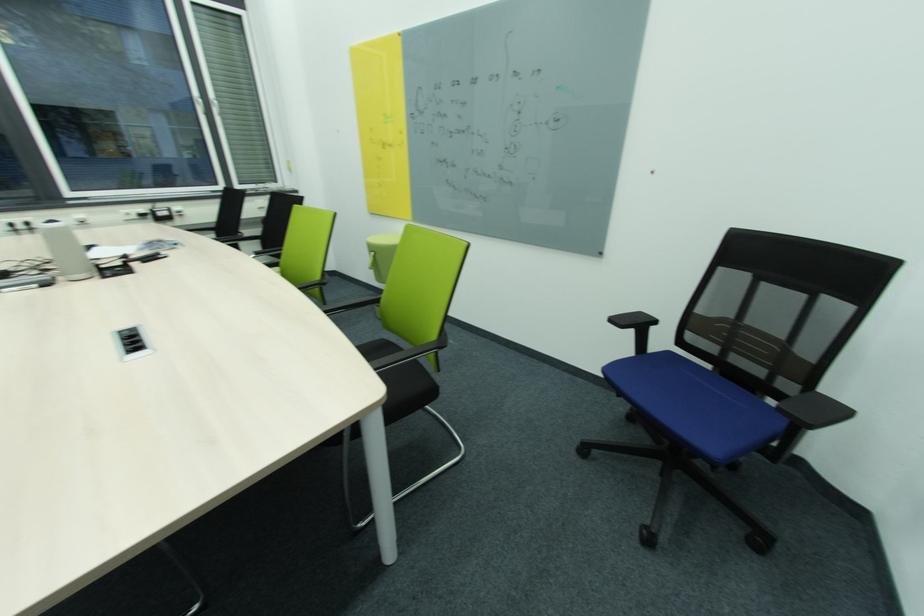
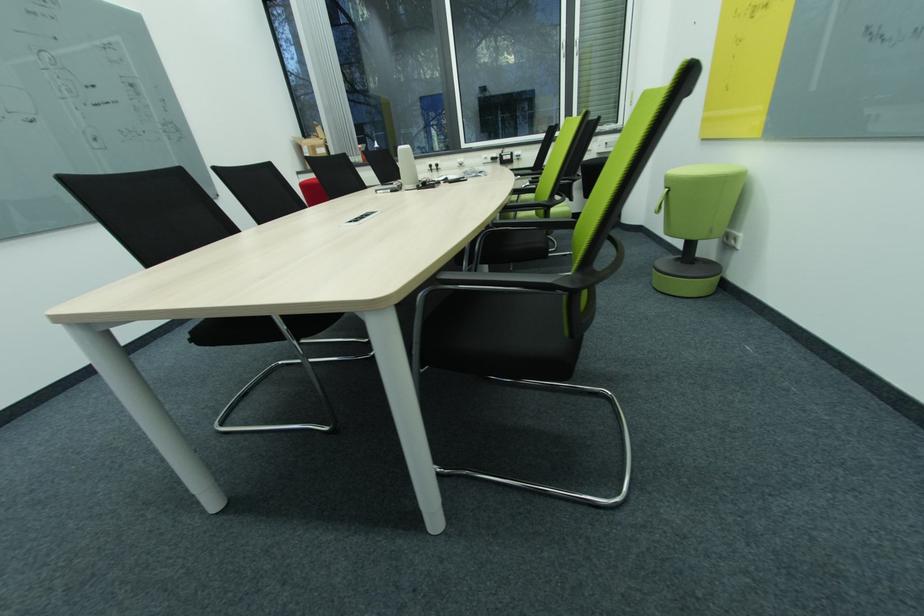
Question: The camera is either moving clockwise (left) or counter-clockwise (right) around the object. The first image is from the beginning of the video and the second image is from the end. Is the camera moving left or right when shooting the video?

Choices:
 (A) Left
 (B) Right

Answer: (B)